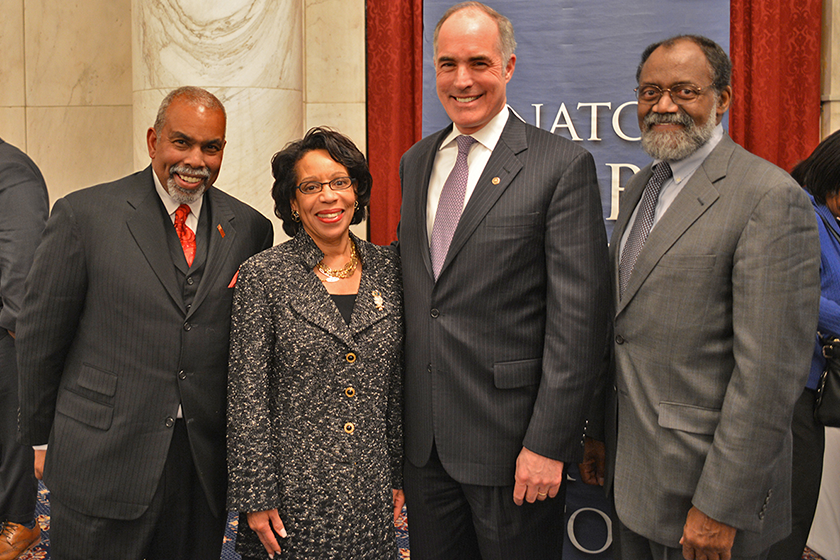
Find the location of a particular element. The image size is (840, 560). carpte is located at coordinates (42, 508).